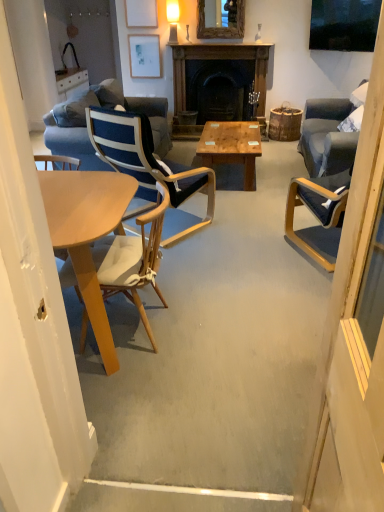
Where is `vacant area located to the right-hand side of natural wood chair at left, the second chair viewed from the back`? This screenshot has height=512, width=384. vacant area located to the right-hand side of natural wood chair at left, the second chair viewed from the back is located at coordinates (208, 327).